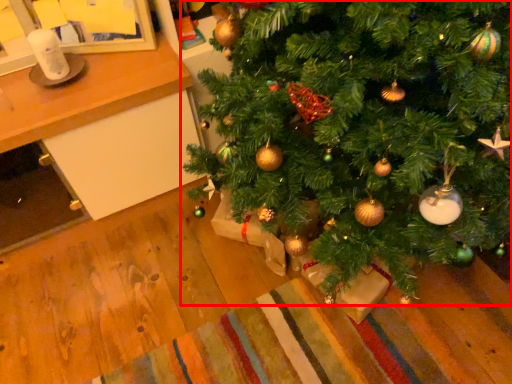
Question: Observing the image, what is the correct spatial positioning of christmas tree (annotated by the red box) in reference to table?

Choices:
 (A) left
 (B) right

Answer: (B)